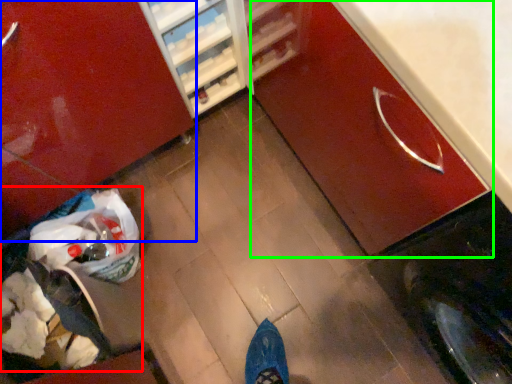
Question: Based on their relative distances, which object is nearer to garbage (highlighted by a red box)? Choose from cabinetry (highlighted by a blue box) and cabinetry (highlighted by a green box).

Choices:
 (A) cabinetry
 (B) cabinetry

Answer: (A)